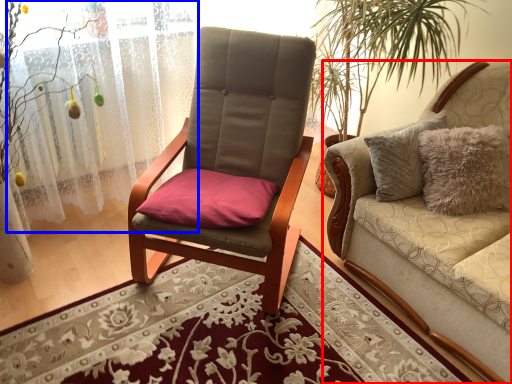
Question: Which of the following is the closest to the observer, studio couch (highlighted by a red box) or curtain (highlighted by a blue box)?

Choices:
 (A) studio couch
 (B) curtain

Answer: (A)